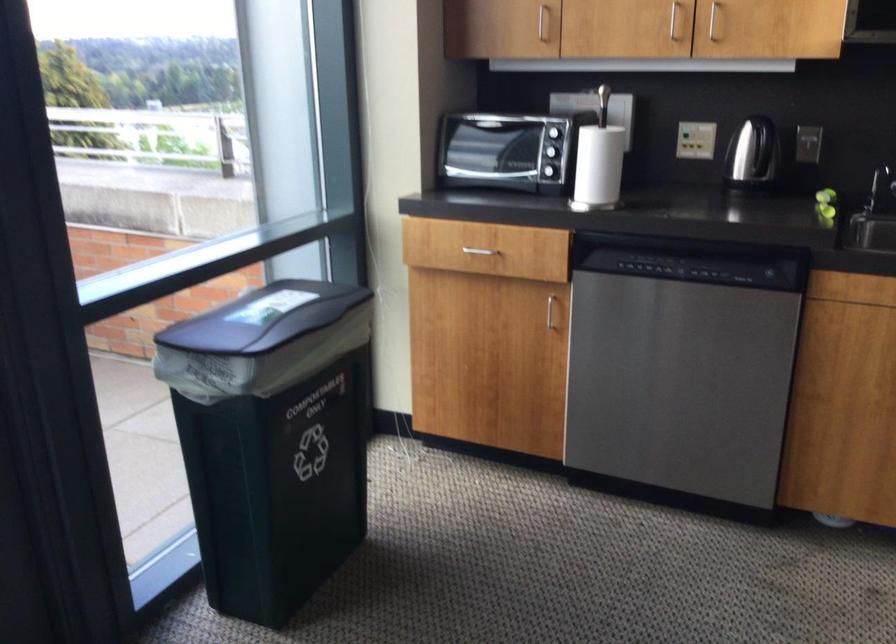
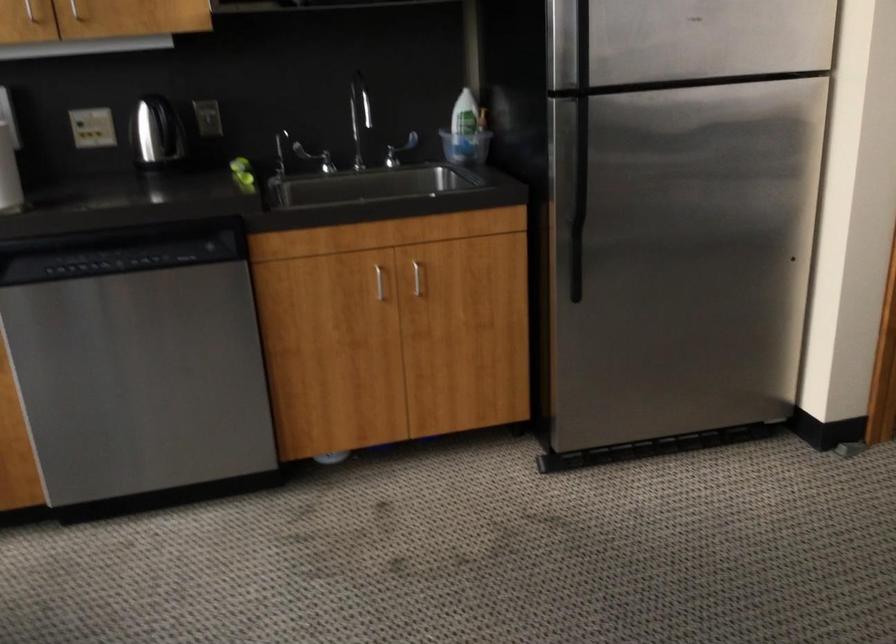
Question: The camera is either moving clockwise (left) or counter-clockwise (right) around the object. The first image is from the beginning of the video and the second image is from the end. Is the camera moving left or right when shooting the video?

Choices:
 (A) Left
 (B) Right

Answer: (A)